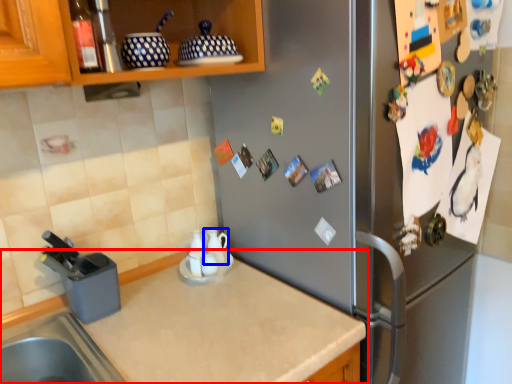
Question: Which point is further to the camera, countertop (highlighted by a red box) or tea pot (highlighted by a blue box)?

Choices:
 (A) countertop
 (B) tea pot

Answer: (B)